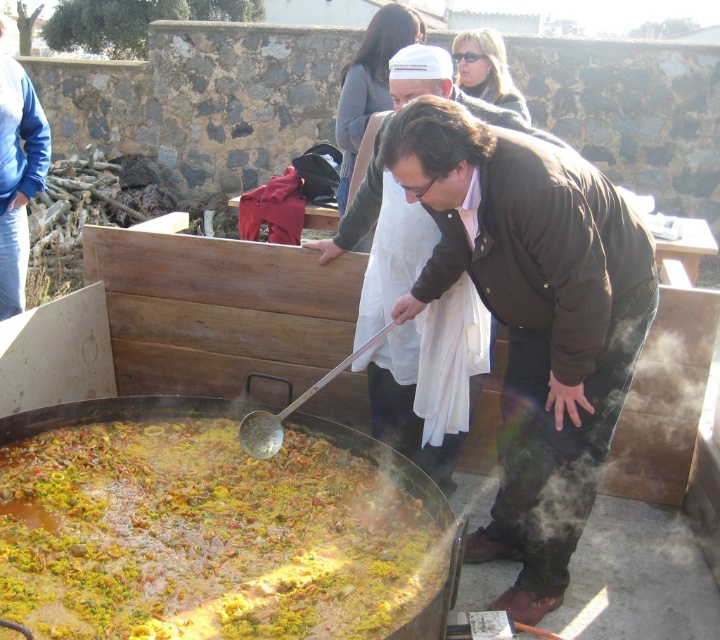
Is blue cotton robe at left bigger than white cotton robe at upper center?

Correct, blue cotton robe at left is larger in size than white cotton robe at upper center.

Between blue cotton robe at left and white cotton robe at upper center, which one appears on the right side from the viewer's perspective?

white cotton robe at upper center is more to the right.

Which is in front, point (9, 56) or point (368, 116)?

Point (368, 116) is in front.

The height and width of the screenshot is (640, 720). In order to click on blue cotton robe at left in this screenshot , I will do `click(18, 177)`.

Which of these two, brown cotton robe at center or white cotton robe at upper center, stands taller?

Standing taller between the two is brown cotton robe at center.

Which is behind, point (526, 204) or point (372, 88)?

Point (372, 88)

This screenshot has width=720, height=640. Find the location of `brown cotton robe at center`. brown cotton robe at center is located at coordinates (549, 333).

Can you confirm if brown leather jacket at center is wider than blue cotton robe at left?

Correct, the width of brown leather jacket at center exceeds that of blue cotton robe at left.

What do you see at coordinates (382, 243) in the screenshot?
I see `brown leather jacket at center` at bounding box center [382, 243].

You are a GUI agent. You are given a task and a screenshot of the screen. Output one action in this format:
    pyautogui.click(x=<x>, y=<y>)
    Task: Click on the brown leather jacket at center
    The image size is (720, 640).
    Given the screenshot: What is the action you would take?
    pyautogui.click(x=382, y=243)